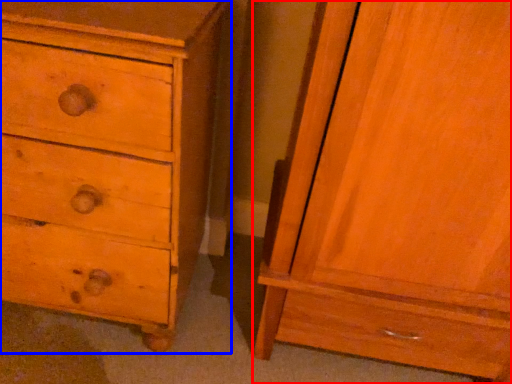
Question: Which point is further to the camera, nightstand (highlighted by a red box) or chest of drawers (highlighted by a blue box)?

Choices:
 (A) nightstand
 (B) chest of drawers

Answer: (B)